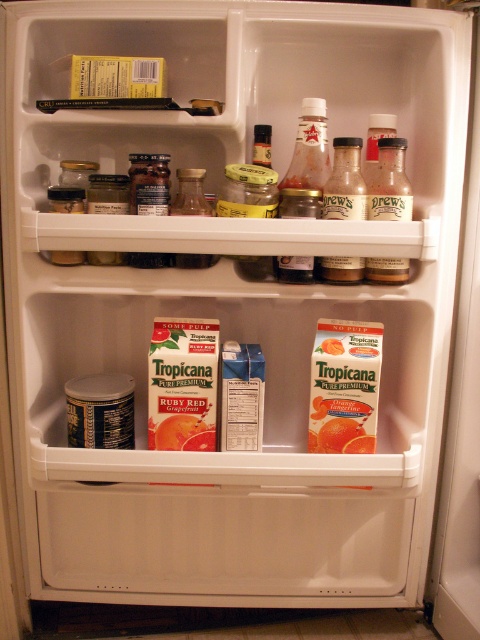
Is translucent glass jar at upper center closer to the viewer compared to clear glass jar at center?

That is False.

Between point (146, 198) and point (204, 196), which one is positioned in front?

Point (146, 198) is in front.

Is point (132, 208) closer to viewer compared to point (177, 177)?

Yes.

Where is `translucent glass jar at upper center`? The image size is (480, 640). translucent glass jar at upper center is located at coordinates (148, 182).

Is point (392, 168) positioned behind point (168, 212)?

Yes, it is.

Who is more distant from viewer, (x=398, y=193) or (x=156, y=266)?

The point (x=156, y=266) is more distant.

At what (x,y) coordinates should I click in order to perform the action: click on clear glass bottle at upper right. Please return your answer as a coordinate pair (x, y). Looking at the image, I should click on (389, 182).

What do you see at coordinates (389, 182) in the screenshot? The image size is (480, 640). I see `clear glass bottle at upper right` at bounding box center [389, 182].

Does point (396, 282) come behind point (322, 266)?

That is False.

Image resolution: width=480 pixels, height=640 pixels. Find the location of `clear glass bottle at upper right`. clear glass bottle at upper right is located at coordinates (389, 182).